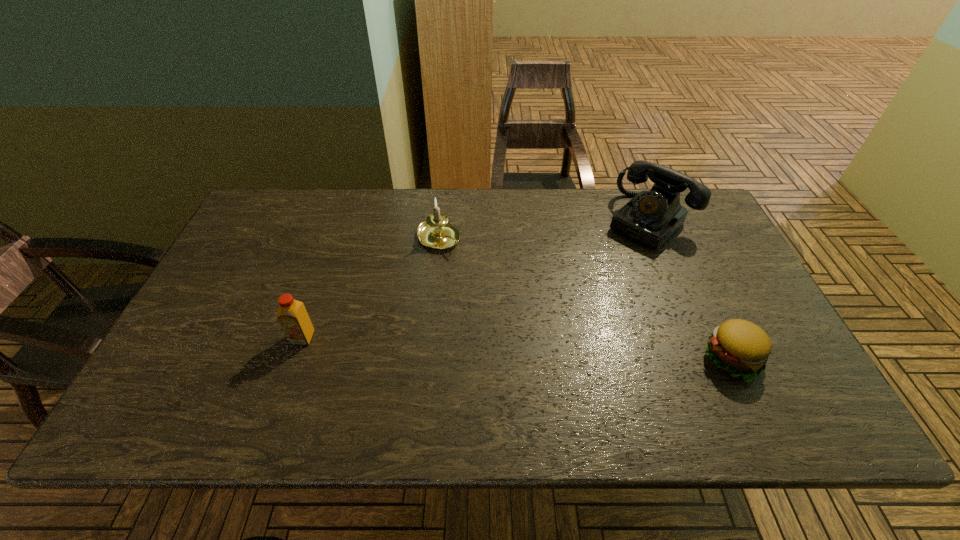
Identify the location of vacant space on the desktop that is between the orange juice and the hamburger and is positioned on the dial of the telephone. The height and width of the screenshot is (540, 960). (515, 348).

I want to click on free space on the desktop that is between the leftmost object and the hamburger and is positioned on the handle side of the candle holder, so click(570, 351).